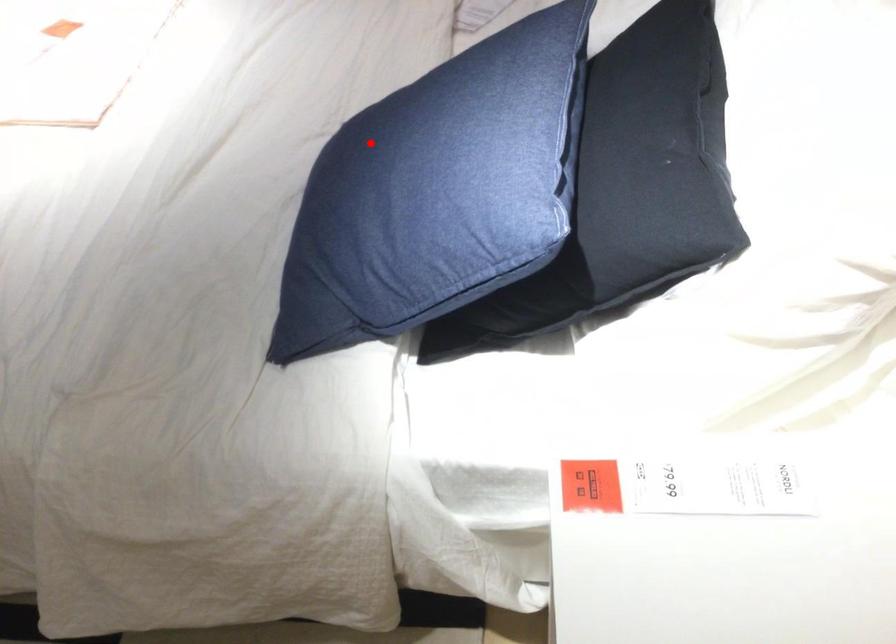
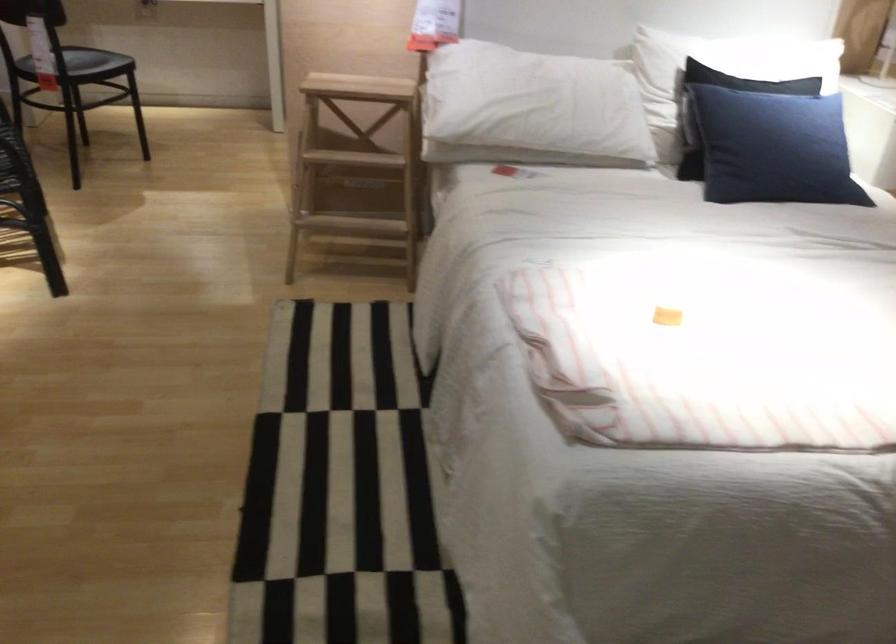
Question: I am providing you with two images of the same scene from different viewpoints. In image1, a red point is highlighted. Considering the same 3D point in image2, which of the following is correct?

Choices:
 (A) It is closer
 (B) It is farther

Answer: (B)